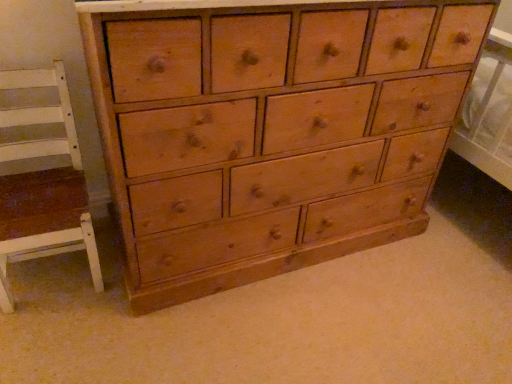
The width and height of the screenshot is (512, 384). I want to click on vacant area in front of white painted wood chair at left, so click(x=52, y=339).